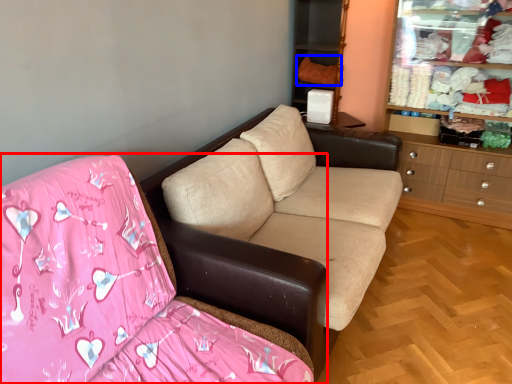
Question: Which object is further to the camera taking this photo, studio couch (highlighted by a red box) or clothing (highlighted by a blue box)?

Choices:
 (A) studio couch
 (B) clothing

Answer: (B)